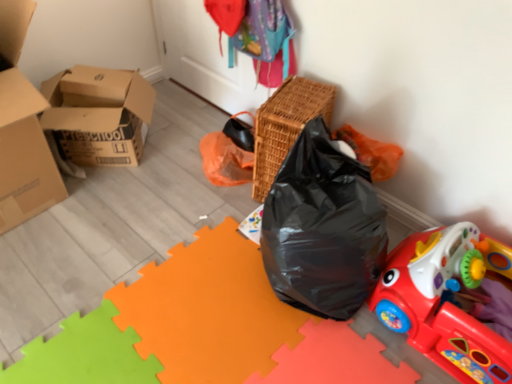
Locate an element on the screen. Image resolution: width=512 pixels, height=384 pixels. rubberized plastic toy car at lower right is located at coordinates (441, 303).

Looking at this image, is woven brown basket at upper center oriented away from cardboard boxes at left?

No, woven brown basket at upper center is not facing away from cardboard boxes at left.

Would you say cardboard boxes at left is part of woven brown basket at upper center's contents?

No.

From a real-world perspective, is woven brown basket at upper center on cardboard boxes at left?

Yes, from a real-world perspective, woven brown basket at upper center is over cardboard boxes at left

Which object is closer to the camera, cardboard boxes at left or rubberized plastic toy car at lower right?

rubberized plastic toy car at lower right is closer to the camera.

Which is in front, point (48, 84) or point (458, 341)?

The point (458, 341) is in front.

Locate an element on the screen. Image resolution: width=512 pixels, height=384 pixels. toy below the cardboard boxes at left (from a real-world perspective) is located at coordinates (441, 303).

Can rubberized plastic toy car at lower right be found inside cardboard boxes at left?

No, rubberized plastic toy car at lower right is not inside cardboard boxes at left.

Is rubberized plastic toy car at lower right not close to cardboard boxes at left?

Yes, rubberized plastic toy car at lower right is far from cardboard boxes at left.

Is rubberized plastic toy car at lower right turned away from cardboard boxes at left?

rubberized plastic toy car at lower right does not have its back to cardboard boxes at left.

Which is in front, rubberized plastic toy car at lower right or cardboard boxes at left?

Positioned in front is rubberized plastic toy car at lower right.

In terms of width, does rubberized plastic toy car at lower right look wider or thinner when compared to cardboard boxes at left?

rubberized plastic toy car at lower right is wider than cardboard boxes at left.

In the scene shown: Which of these two, cardboard boxes at left or woven brown basket at upper center, stands taller?

woven brown basket at upper center is taller.

Considering the sizes of objects cardboard boxes at left and woven brown basket at upper center in the image provided, who is bigger, cardboard boxes at left or woven brown basket at upper center?

With larger size is cardboard boxes at left.

Does cardboard boxes at left touch woven brown basket at upper center?

cardboard boxes at left and woven brown basket at upper center are not in contact.

Is cardboard boxes at left oriented away from woven brown basket at upper center?

cardboard boxes at left is not turned away from woven brown basket at upper center.

Does point (284, 100) come behind point (506, 367)?

Yes, point (284, 100) is behind point (506, 367).

Are woven brown basket at upper center and rubberized plastic toy car at lower right located far from each other?

woven brown basket at upper center is actually quite close to rubberized plastic toy car at lower right.

Which object is more forward, woven brown basket at upper center or rubberized plastic toy car at lower right?

rubberized plastic toy car at lower right is in front.

Considering the sizes of objects woven brown basket at upper center and rubberized plastic toy car at lower right in the image provided, who is bigger, woven brown basket at upper center or rubberized plastic toy car at lower right?

rubberized plastic toy car at lower right is bigger.

Considering the sizes of objects rubberized plastic toy car at lower right and woven brown basket at upper center in the image provided, who is wider, rubberized plastic toy car at lower right or woven brown basket at upper center?

rubberized plastic toy car at lower right.

Is rubberized plastic toy car at lower right facing away from woven brown basket at upper center?

No, rubberized plastic toy car at lower right is not facing the opposite direction of woven brown basket at upper center.

From a real-world perspective, is rubberized plastic toy car at lower right below woven brown basket at upper center?

Yes.

In the image, is rubberized plastic toy car at lower right positioned in front of or behind woven brown basket at upper center?

Visually, rubberized plastic toy car at lower right is located in front of woven brown basket at upper center.

Where is `box located above the woven brown basket at upper center (from the image's perspective)`? The width and height of the screenshot is (512, 384). box located above the woven brown basket at upper center (from the image's perspective) is located at coordinates (98, 114).

Where is `box behind the rubberized plastic toy car at lower right`? This screenshot has height=384, width=512. box behind the rubberized plastic toy car at lower right is located at coordinates (98, 114).

When comparing their distances from cardboard boxes at left, does woven brown basket at upper center or rubberized plastic toy car at lower right seem further?

Among the two, rubberized plastic toy car at lower right is located further to cardboard boxes at left.

From the image, which object appears to be farther from rubberized plastic toy car at lower right, cardboard boxes at left or woven brown basket at upper center?

cardboard boxes at left is positioned further to the anchor rubberized plastic toy car at lower right.

Which object lies further to the anchor point rubberized plastic toy car at lower right, woven brown basket at upper center or cardboard boxes at left?

cardboard boxes at left is positioned further to the anchor rubberized plastic toy car at lower right.

When comparing their distances from woven brown basket at upper center, does cardboard boxes at left or rubberized plastic toy car at lower right seem further?

cardboard boxes at left.

Which object lies further to the anchor point cardboard boxes at left, rubberized plastic toy car at lower right or woven brown basket at upper center?

rubberized plastic toy car at lower right is further to cardboard boxes at left.

Considering their positions, is rubberized plastic toy car at lower right positioned further to woven brown basket at upper center than cardboard boxes at left?

cardboard boxes at left is positioned further to the anchor woven brown basket at upper center.

This screenshot has height=384, width=512. What are the coordinates of `basket between cardboard boxes at left and rubberized plastic toy car at lower right in the horizontal direction` in the screenshot? It's located at (285, 126).